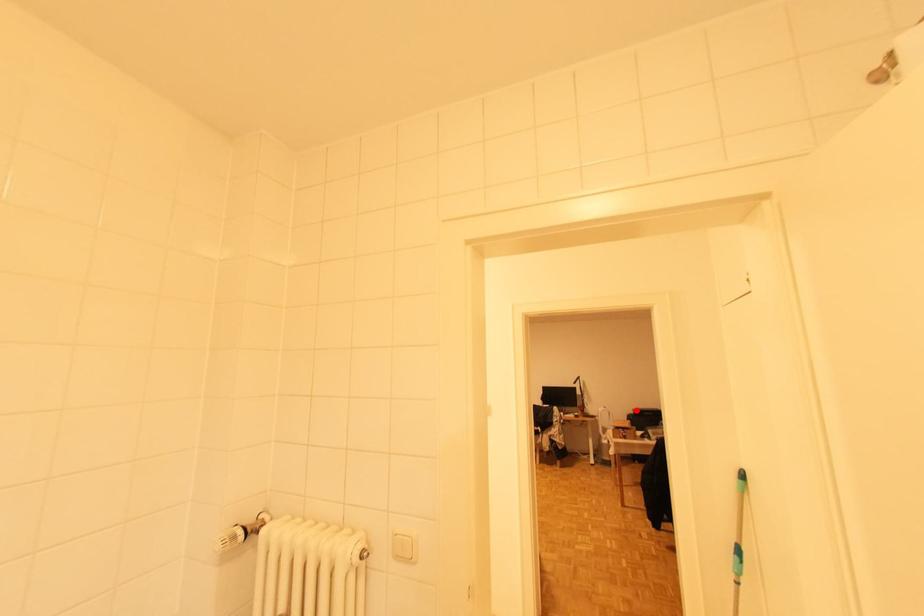
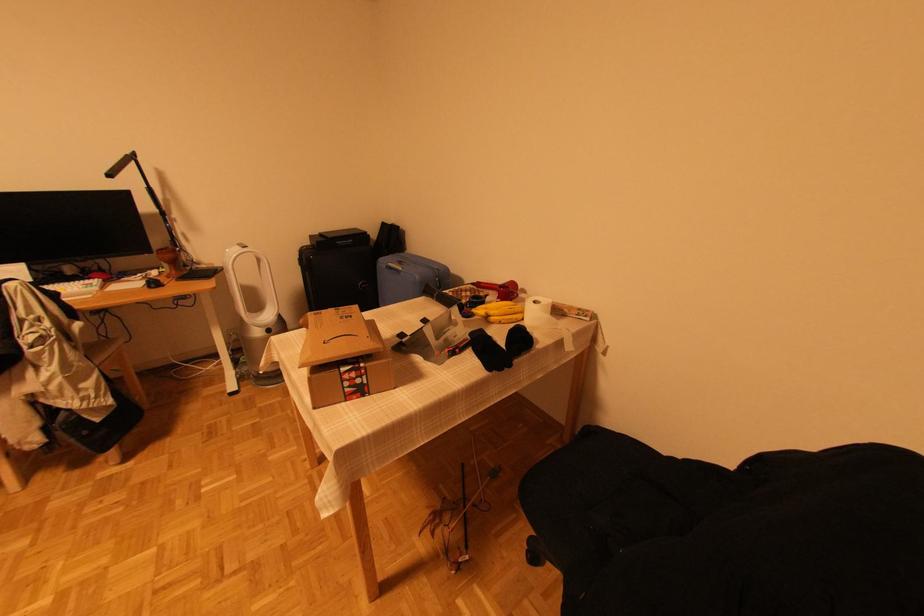
The point at the highlighted location is marked in the first image. Where is the corresponding point in the second image?

(314, 238)